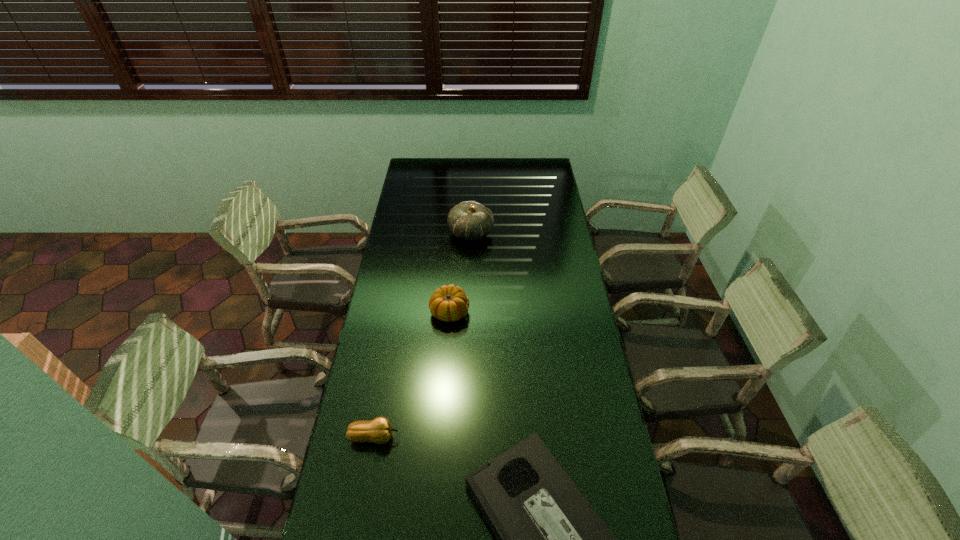
Where is `free region that satisfies the following two spatial constraints: 1. on the front side of the third nearest object; 2. on the stem side of the second shortest object`? free region that satisfies the following two spatial constraints: 1. on the front side of the third nearest object; 2. on the stem side of the second shortest object is located at coordinates (442, 437).